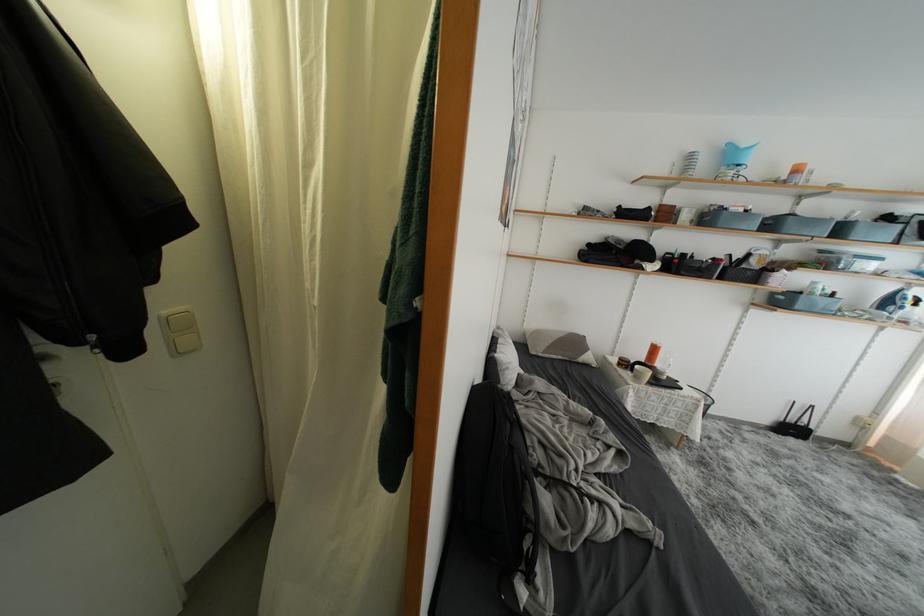
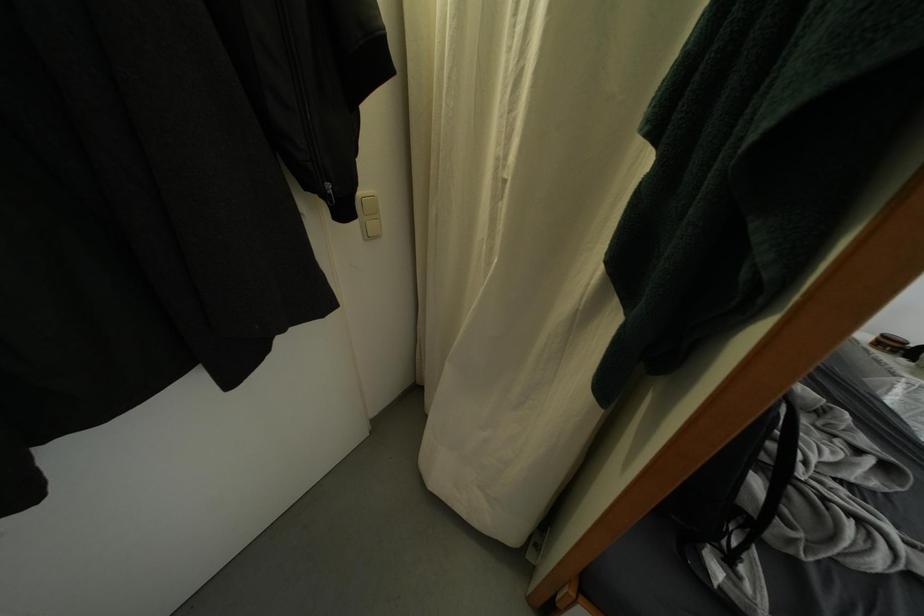
Where in the second image is the point corresponding to (x=626, y=369) from the first image?

(884, 347)